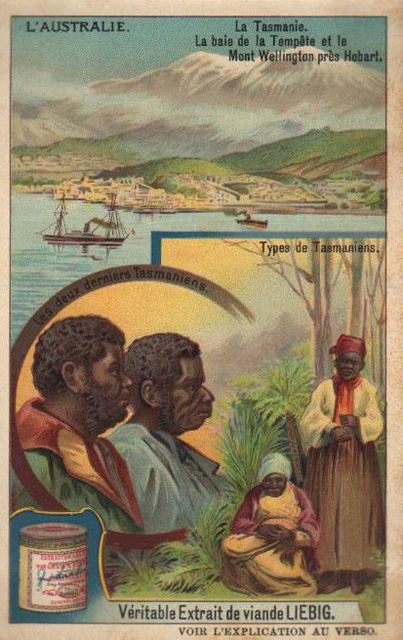
Who is lower down, matte brown dress at right or smooth skin face at center?

matte brown dress at right is lower down.

Does matte brown dress at right appear over smooth skin face at center?

No.

Is point (334, 582) less distant than point (182, 440)?

No, (334, 582) is behind (182, 440).

This screenshot has width=403, height=640. What are the coordinates of `matte brown dress at right` in the screenshot? It's located at (344, 468).

Between point (126, 397) and point (95, 240), which one is positioned in front?

Point (126, 397) is in front.

Who is more distant from viewer, (101, 484) or (108, 209)?

Point (108, 209)

I want to click on dark skin textured face at center, so click(80, 419).

Is smooth skin face at center below wooden ship at upper center?

Yes, smooth skin face at center is below wooden ship at upper center.

Consider the image. Does smooth skin face at center appear over wooden ship at upper center?

No, smooth skin face at center is not above wooden ship at upper center.

Measure the distance between smooth skin face at center and camera.

smooth skin face at center and camera are 3.08 meters apart from each other.

Where is `smooth skin face at center`? This screenshot has height=640, width=403. smooth skin face at center is located at coordinates (166, 432).